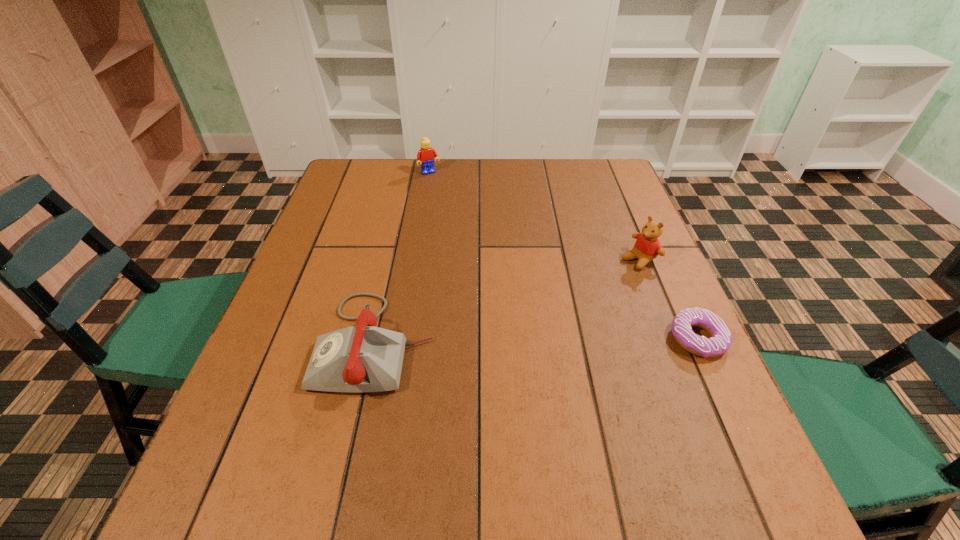
This screenshot has width=960, height=540. Find the location of `free region at the right edge`. free region at the right edge is located at coordinates (612, 244).

You are a GUI agent. You are given a task and a screenshot of the screen. Output one action in this format:
    pyautogui.click(x=<x>, y=<y>)
    Task: Click on the vacant space at the far left corner
    The width and height of the screenshot is (960, 540).
    Given the screenshot: What is the action you would take?
    pyautogui.click(x=388, y=172)

In the image, there is a desktop. In order to click on vacant space at the near left corner in this screenshot , I will do `click(300, 451)`.

I want to click on free space between the Lego and the second shortest object, so click(x=402, y=258).

I want to click on vacant area that lies between the second farthest object and the telephone, so click(508, 301).

This screenshot has width=960, height=540. What are the coordinates of `free space between the second shortest object and the shortest object` in the screenshot? It's located at (537, 341).

In order to click on empty space between the shortest object and the farthest object in this screenshot , I will do `click(564, 256)`.

Locate an element on the screen. This screenshot has width=960, height=540. empty location between the Lego and the teddy bear is located at coordinates (534, 216).

Where is `unoccupied position between the teddy bear and the third tallest object`? unoccupied position between the teddy bear and the third tallest object is located at coordinates (508, 301).

Where is `free spot between the second shortest object and the Lego`? Image resolution: width=960 pixels, height=540 pixels. free spot between the second shortest object and the Lego is located at coordinates (402, 258).